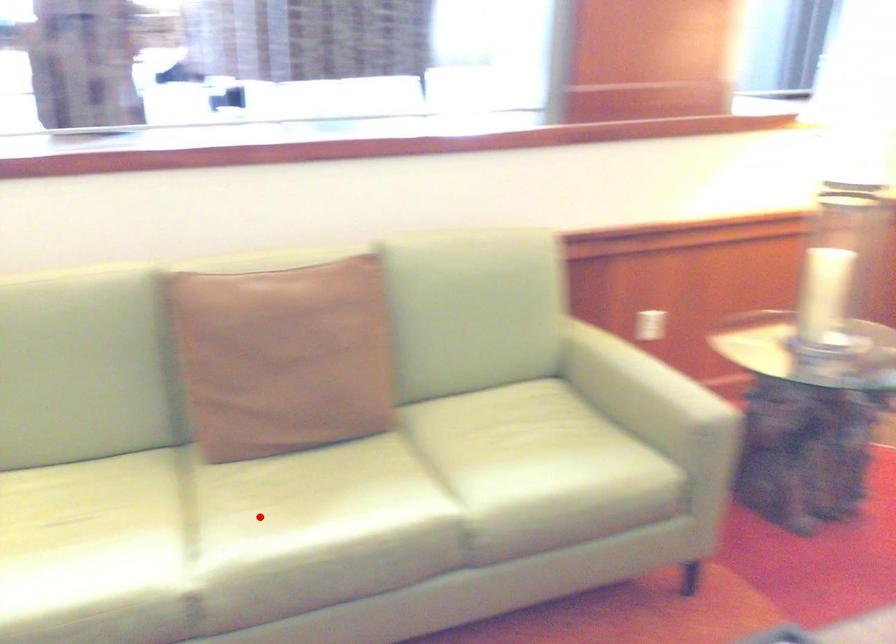
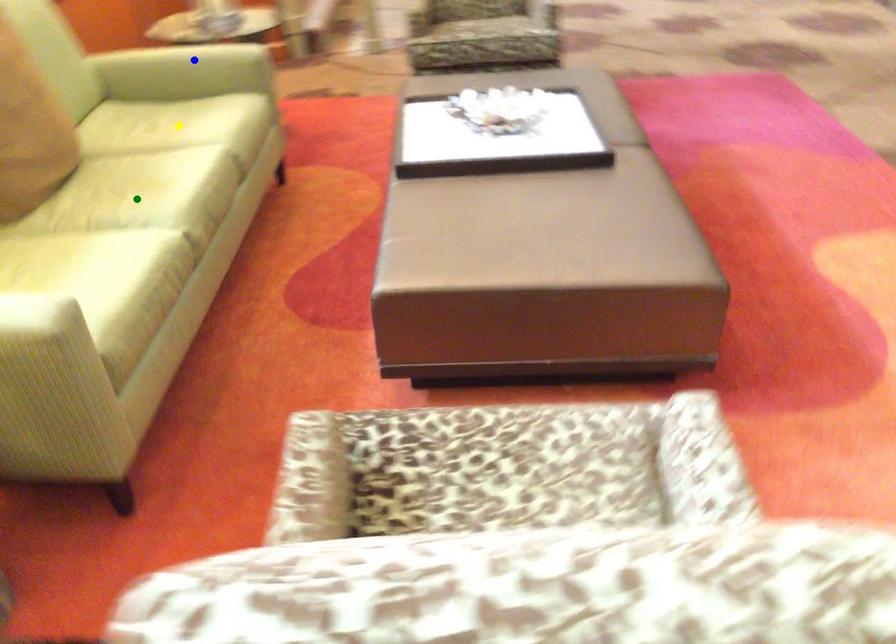
Question: I am providing you with two images of the same scene from different viewpoints. A red point is marked on the first image. You are given multiple points on the second image. Which mark in image 2 goes with the point in image 1?

Choices:
 (A) blue point
 (B) yellow point
 (C) green point

Answer: (C)